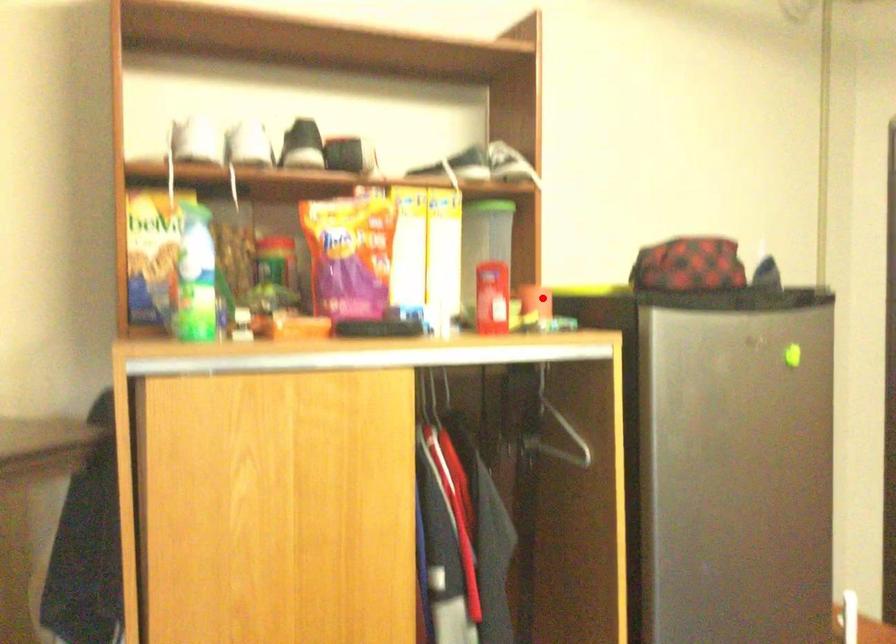
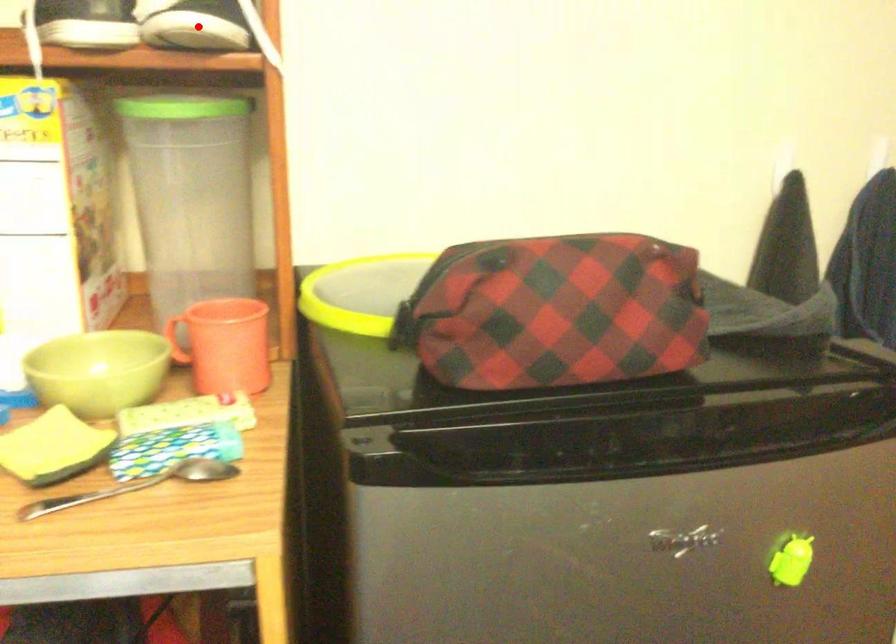
I am providing you with two images of the same scene from different viewpoints. A red point is marked on the first image and another point is marked on the second image. Are the points marked in image1 and image2 representing the same 3D position?

No